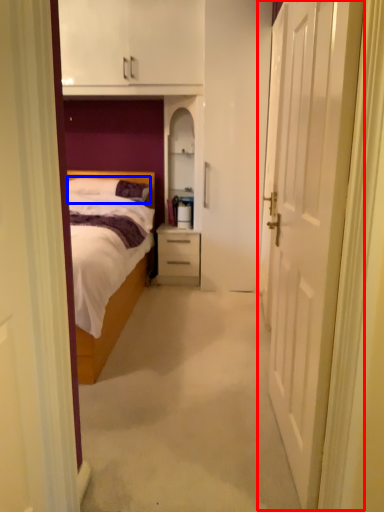
Question: Which object appears farthest to the camera in this image, door (highlighted by a red box) or pillow (highlighted by a blue box)?

Choices:
 (A) door
 (B) pillow

Answer: (B)